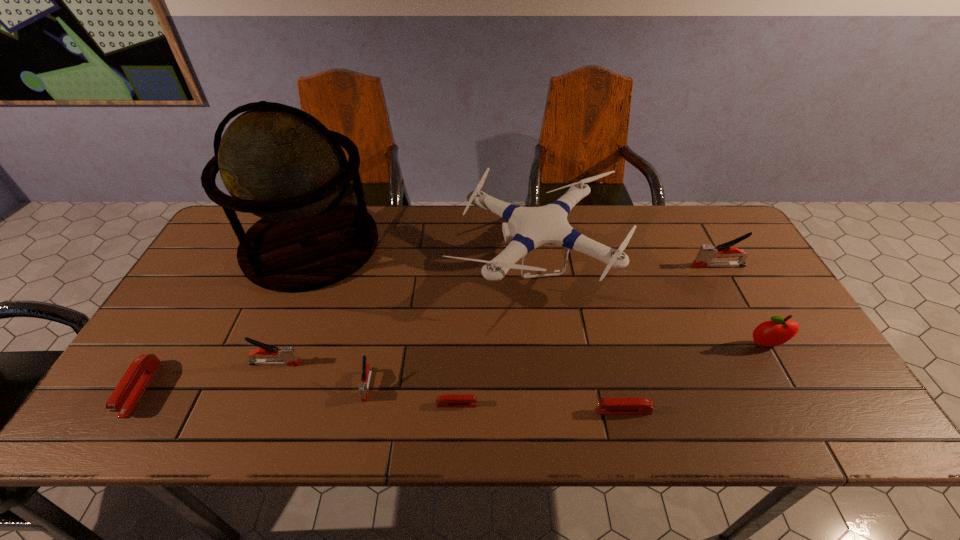
You are a GUI agent. You are given a task and a screenshot of the screen. Output one action in this format:
    pyautogui.click(x=<x>, y=<y>)
    Task: Click on the leftmost red stapler
    
    Given the screenshot: What is the action you would take?
    pyautogui.click(x=129, y=390)

Where is `the fourth tallest stapler`? This screenshot has height=540, width=960. the fourth tallest stapler is located at coordinates (129, 390).

Locate an element on the screen. The width and height of the screenshot is (960, 540). the second smallest red stapler is located at coordinates (634, 405).

Find the location of `the rightmost red stapler`. the rightmost red stapler is located at coordinates (634, 405).

This screenshot has height=540, width=960. Find the location of `the shortest object`. the shortest object is located at coordinates (449, 400).

Find the location of a particular element. the second red stapler from right to left is located at coordinates (449, 400).

The width and height of the screenshot is (960, 540). What are the coordinates of `vacant area situated on the front-facing side of the globe` in the screenshot? It's located at (505, 245).

In order to click on free space located on the right of the blue drone in this screenshot , I will do (x=747, y=259).

Image resolution: width=960 pixels, height=540 pixels. Find the location of `vacant region located 0.170m on the handle side of the farthest gray stapler`. vacant region located 0.170m on the handle side of the farthest gray stapler is located at coordinates (636, 266).

Locate an element on the screen. free region located 0.230m on the handle side of the farthest gray stapler is located at coordinates (616, 266).